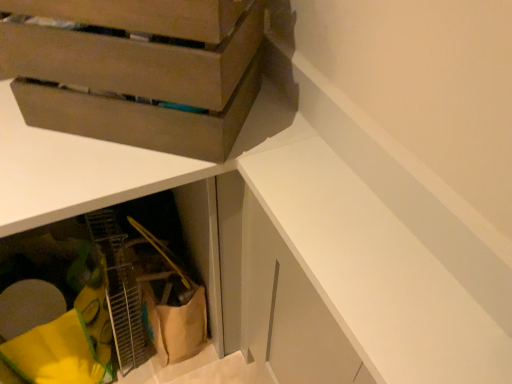
Locate an element on the screen. The image size is (512, 384). vacant space situated on the left part of white matte cabinet at upper right, marked as the 1th cabinetry in a right-to-left arrangement is located at coordinates (287, 160).